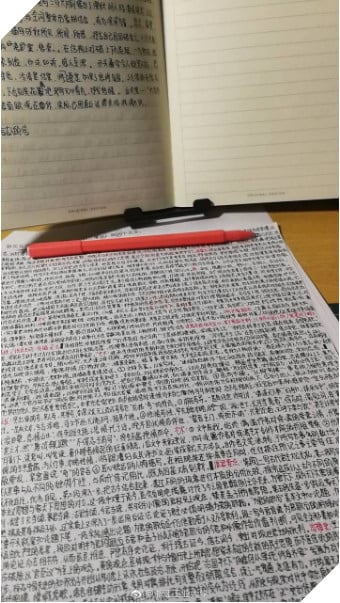
Identify the location of book holder. (133, 213).